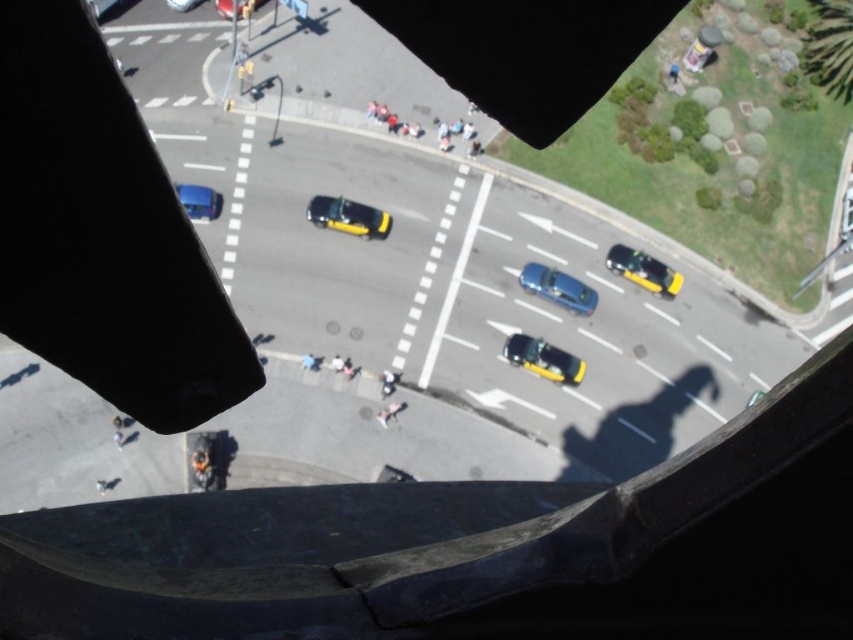
You are a delivery driver navigating through a busy intersection. You need to determine the distance from your current position to a specific point marked at coordinates point [538,358]. Can you confirm if this point is within a safe distance for your vehicle to maneuver?

The point [538,358] is 41.50 meters away from the camera, so it is within a safe distance for the vehicle to maneuver.